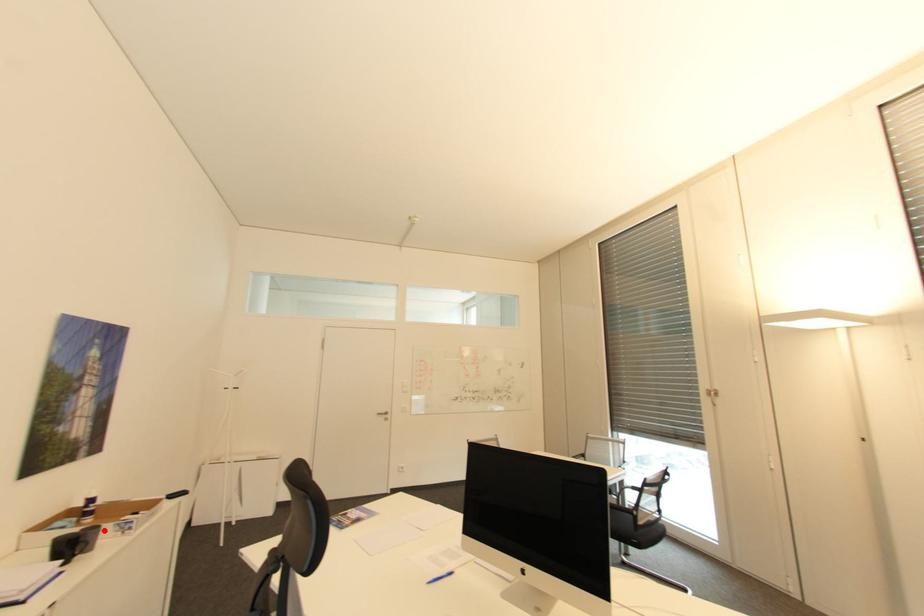
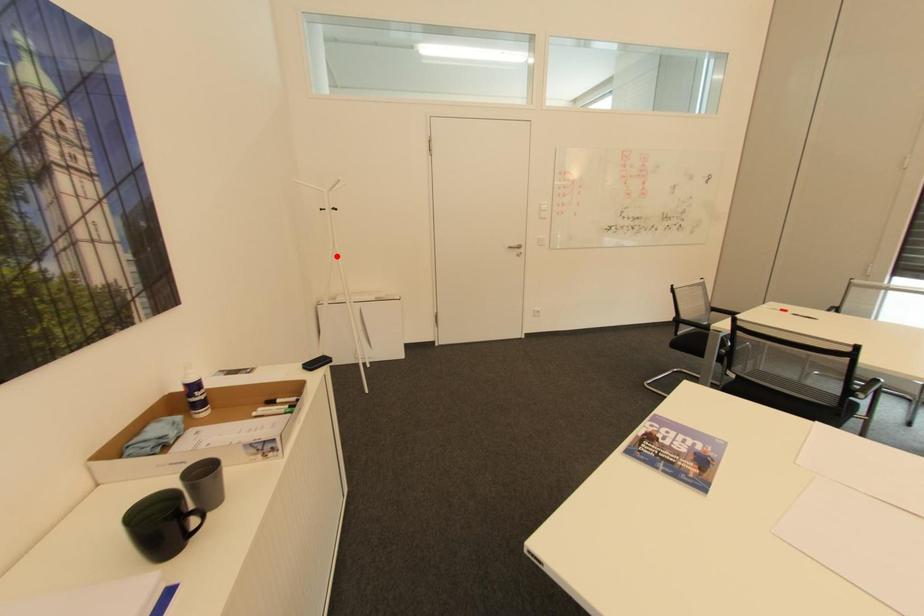
I am providing you with two images of the same scene from different viewpoints. A red point is marked on the first image and another point is marked on the second image. Does the point marked in image1 correspond to the same location as the one in image2?

No